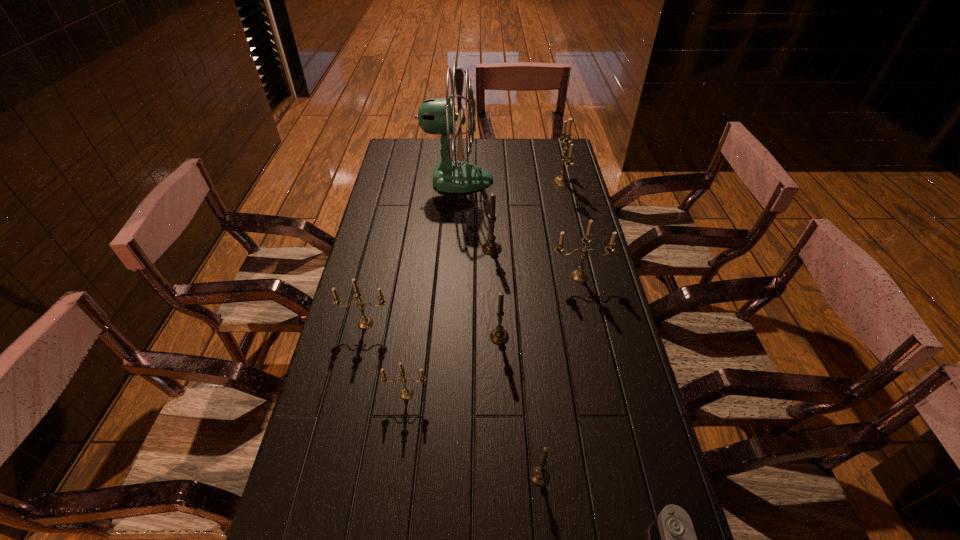
I want to click on empty location between the second nearest gray candle and the farthest gray candle, so click(x=495, y=292).

Image resolution: width=960 pixels, height=540 pixels. I want to click on free spot between the tallest object and the third farthest metallic candle, so click(x=412, y=252).

You are a GUI agent. You are given a task and a screenshot of the screen. Output one action in this format:
    pyautogui.click(x=<x>, y=<y>)
    Task: Click on the free spot between the second farthest gray candle and the fourth farthest object
    Image resolution: width=960 pixels, height=540 pixels.
    Given the screenshot: What is the action you would take?
    pyautogui.click(x=540, y=306)

Identify the location of vacant area that lies between the smallest gray candle and the second biggest metallic candle. (560, 376).

Find the location of `free space between the second biggest gray candle and the fifth nearest candle`. free space between the second biggest gray candle and the fifth nearest candle is located at coordinates (540, 306).

The image size is (960, 540). I want to click on vacant region between the leftmost candle and the biggest metallic candle, so click(464, 253).

The height and width of the screenshot is (540, 960). In order to click on empty space between the third nearest object and the tallest candle in this screenshot , I will do click(x=484, y=288).

Choose which object is the seventh nearest neighbor to the second nearest metallic candle. Please provide its 2D coordinates. Your answer should be formatted as a tuple, i.e. [(x, y)], where the tuple contains the x and y coordinates of a point satisfying the conditions above.

[(672, 539)]

The height and width of the screenshot is (540, 960). What are the coordinates of `object that ranks as the fifth closest to the second nearest gray candle` in the screenshot? It's located at (539, 475).

Identify the location of the second closest candle relative to the biggest metallic candle. (579, 275).